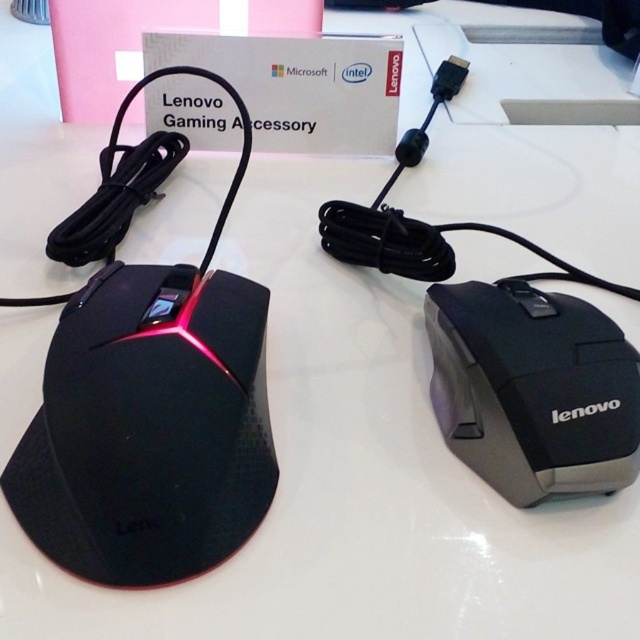
You are organizing a tech fair and need to place a label at point (x=148, y=429) on the image. Which mouse should the label be attached to?

The label at point (x=148, y=429) should be attached to the matte black mouse at left as the coordinates mark its location.

You are setting up a gaming setup and have both the matte black mouse at left and the black matte mouse at right. Which mouse should you choose if you prefer a taller design for better grip?

The matte black mouse at left is much taller than the black matte mouse at right, so you should choose the matte black mouse at left for a taller design with better grip.

You are organizing a tech exhibition and need to arrange the matte black mouse at left and the black matte mouse at right on a shelf. If you want to place them side by side but ensure the one closer to the front is the one with the red accent, which mouse should you position in front?

The matte black mouse at left has the red accent, so you should position it in front to meet the requirement.